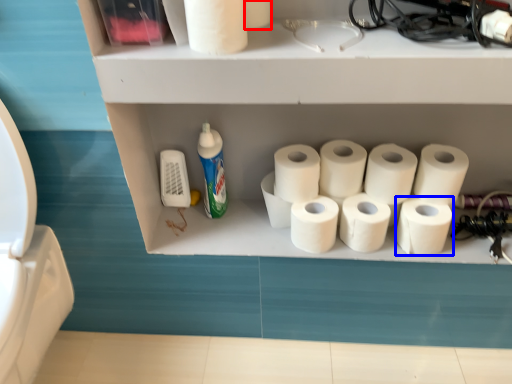
Question: Among these objects, which one is nearest to the camera, toilet paper (highlighted by a red box) or toilet paper (highlighted by a blue box)?

Choices:
 (A) toilet paper
 (B) toilet paper

Answer: (A)